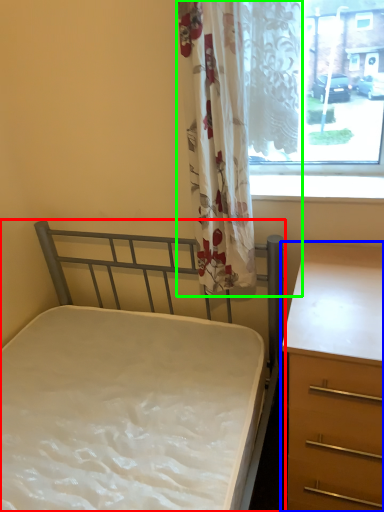
Question: Considering the real-world distances, which object is farthest from bed (highlighted by a red box)? chest of drawers (highlighted by a blue box) or curtain (highlighted by a green box)?

Choices:
 (A) chest of drawers
 (B) curtain

Answer: (B)